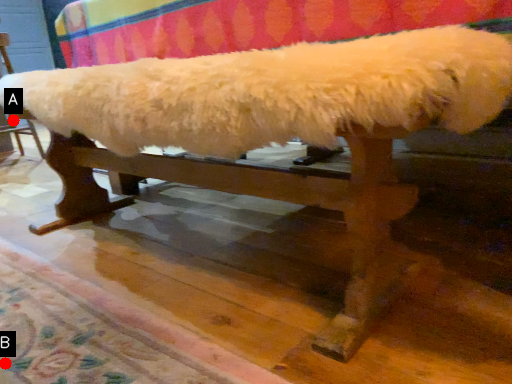
Question: Two points are circled on the image, labeled by A and B beside each circle. Which point is closer to the camera?

Choices:
 (A) A is closer
 (B) B is closer

Answer: (B)